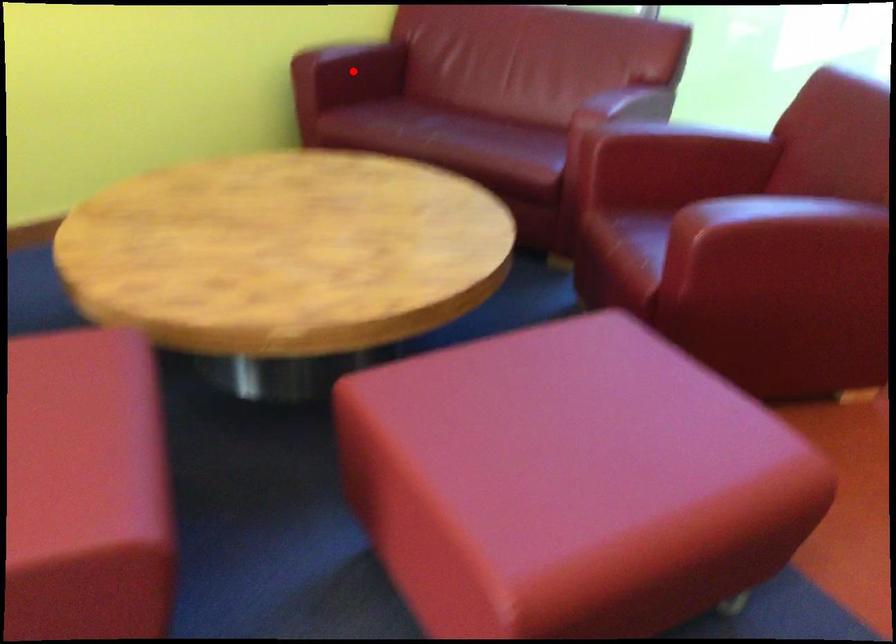
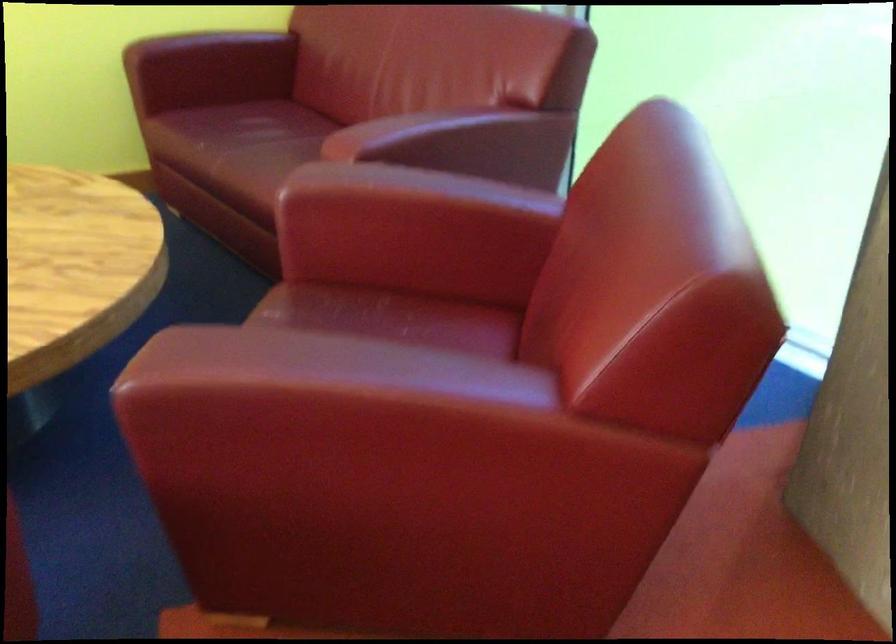
Question: I am providing you with two images of the same scene from different viewpoints. A red point is marked on the first image. Is the red point's position out of view in image 2?

Choices:
 (A) Yes
 (B) No

Answer: (B)